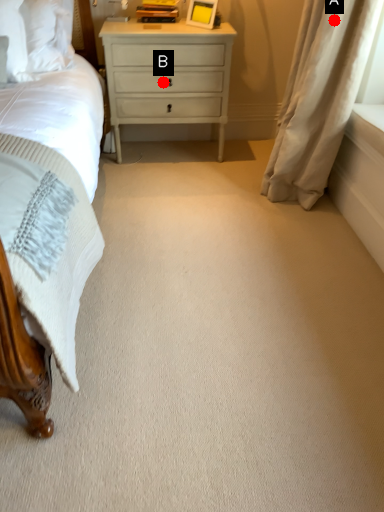
Question: Two points are circled on the image, labeled by A and B beside each circle. Which point is further to the camera?

Choices:
 (A) A is further
 (B) B is further

Answer: (B)